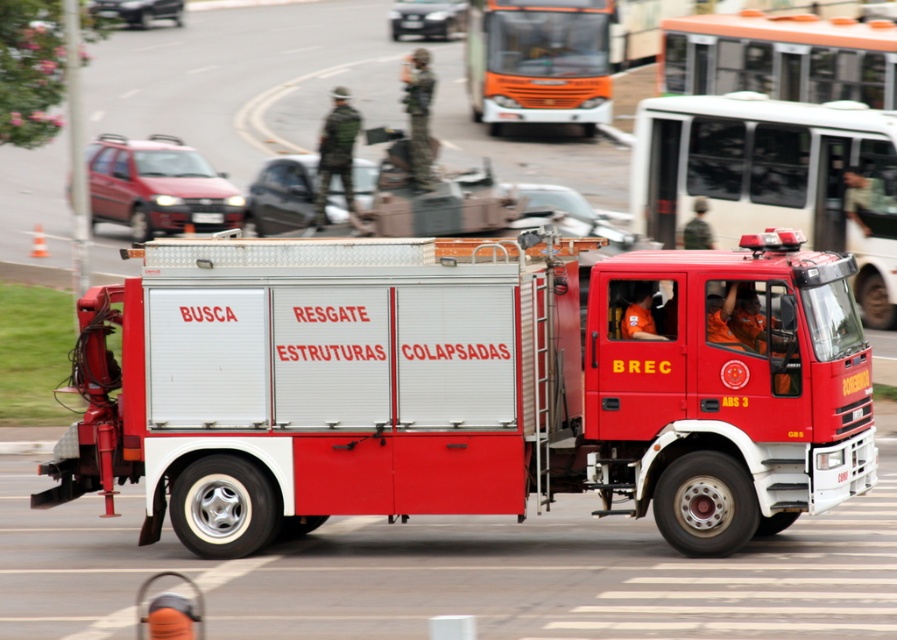
You are a traffic controller trying to direct emergency vehicles. You see a metallic red fire truck at center and a metallic silver bus at upper center. Which vehicle is located to the left of the other?

The metallic red fire truck at center is positioned on the left side of metallic silver bus at upper center.